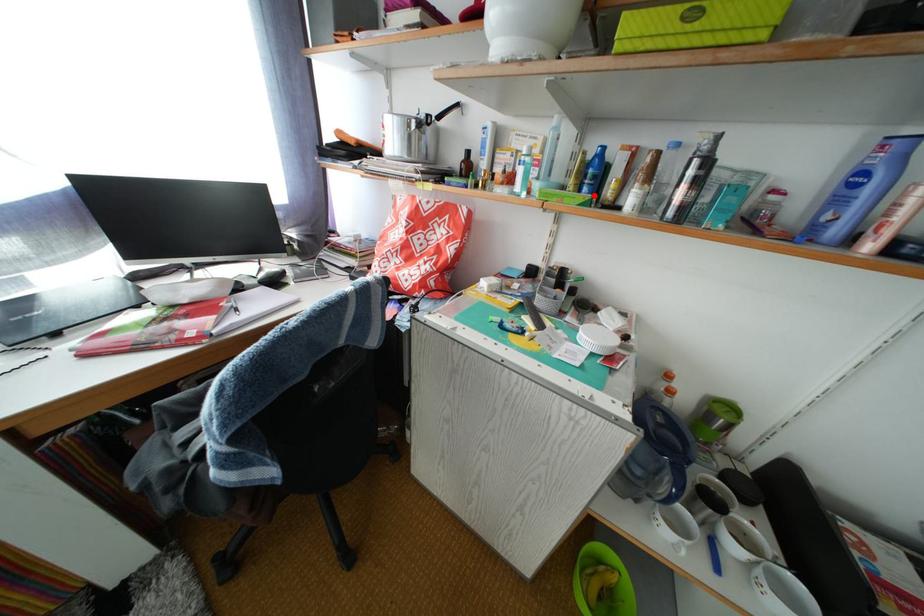
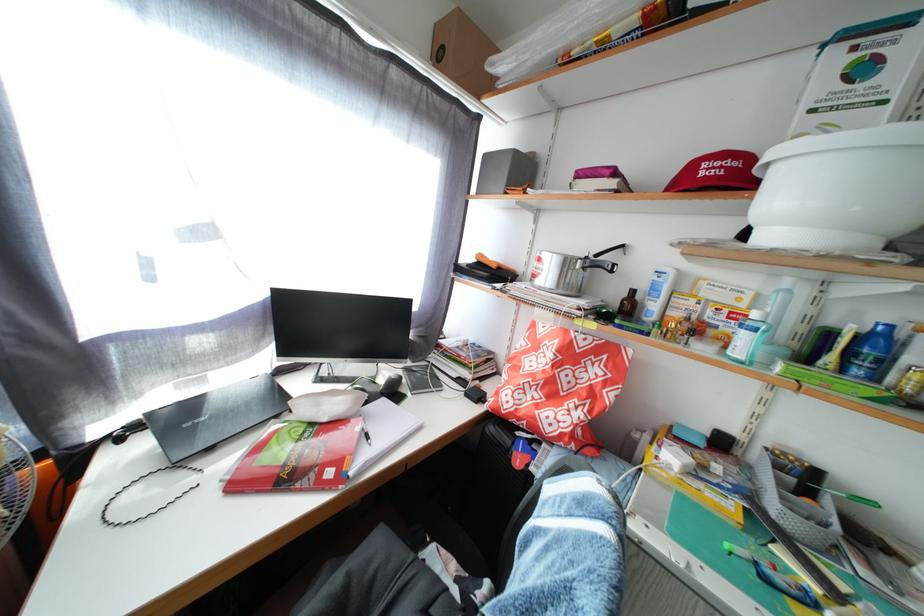
In the second image, find the point that corresponds to the highlighted location in the first image.

(866, 378)